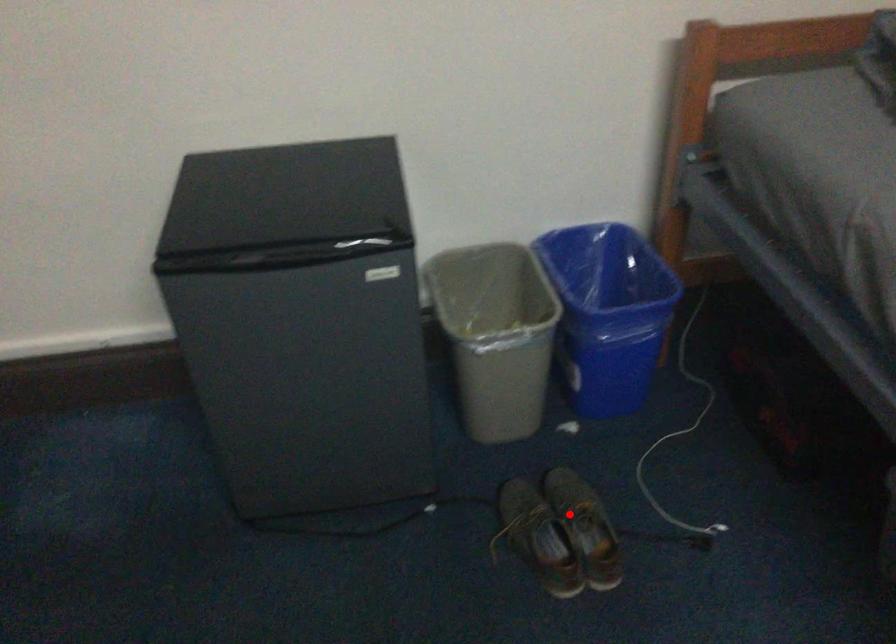
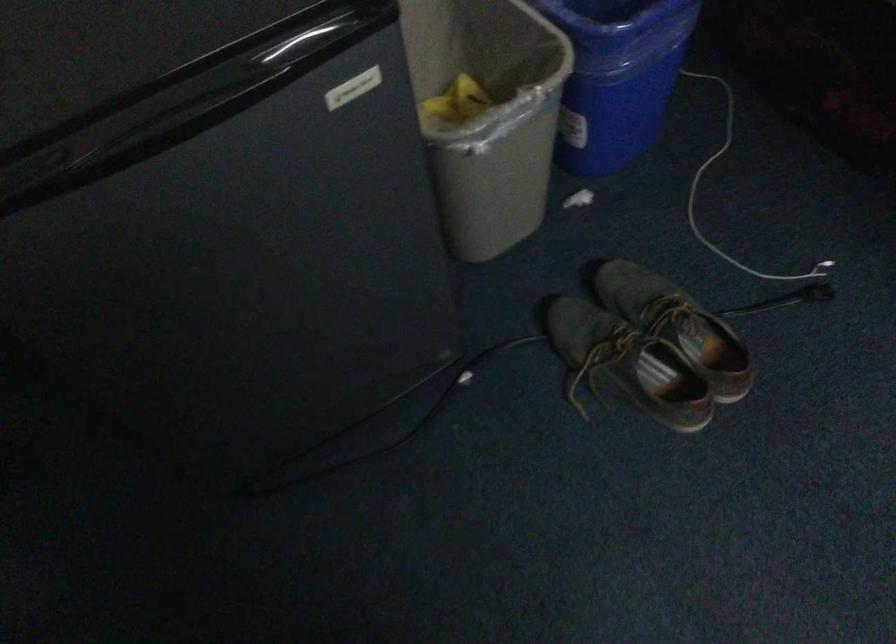
Locate, in the second image, the point that corresponds to the highlighted location in the first image.

(662, 323)